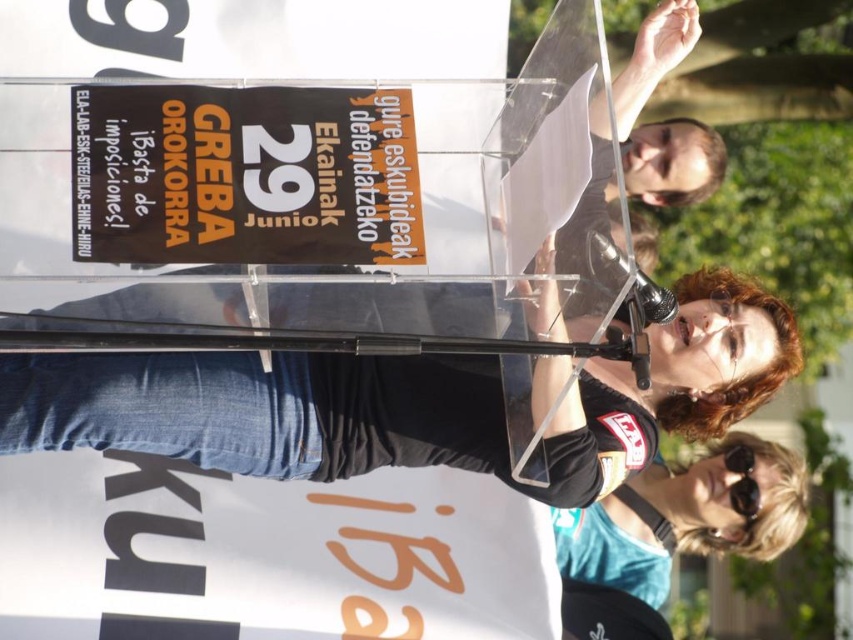
Question: Considering the real-world distances, which object is farthest from the black paper sign at upper center?

Choices:
 (A) teal fabric sunglasses at lower right
 (B) black plastic sunglasses at lower right

Answer: (B)

Question: Is black paper sign at upper center above teal fabric sunglasses at lower right?

Choices:
 (A) yes
 (B) no

Answer: (A)

Question: Which of these objects is positioned closest to the black plastic sunglasses at lower right?

Choices:
 (A) black paper sign at upper center
 (B) teal fabric sunglasses at lower right

Answer: (B)

Question: From the image, what is the correct spatial relationship of black paper sign at upper center in relation to teal fabric sunglasses at lower right?

Choices:
 (A) left
 (B) right

Answer: (A)

Question: Which point is closer to the camera?

Choices:
 (A) (573, 627)
 (B) (294, 216)
 (C) (735, 451)

Answer: (B)

Question: Is teal fabric sunglasses at lower right above black plastic sunglasses at lower right?

Choices:
 (A) no
 (B) yes

Answer: (A)